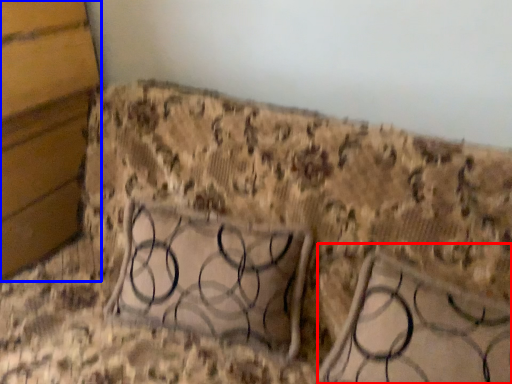
Question: Which of the following is the closest to the observer, furniture (highlighted by a red box) or panel (highlighted by a blue box)?

Choices:
 (A) furniture
 (B) panel

Answer: (A)